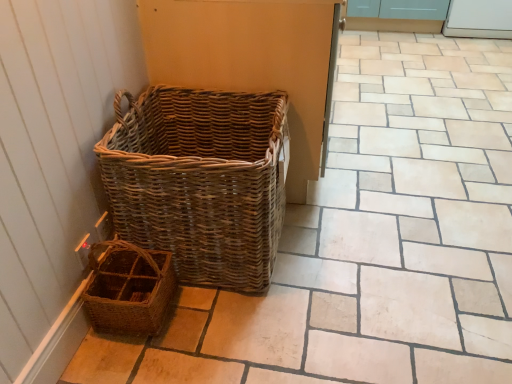
You are a GUI agent. You are given a task and a screenshot of the screen. Output one action in this format:
    pyautogui.click(x=<x>, y=<y>)
    Task: Click on the vacant area that is in front of brown woven picnic basket at lower left, acting as the 1th picnic basket starting from the bottom
    The width and height of the screenshot is (512, 384).
    Given the screenshot: What is the action you would take?
    pyautogui.click(x=128, y=366)